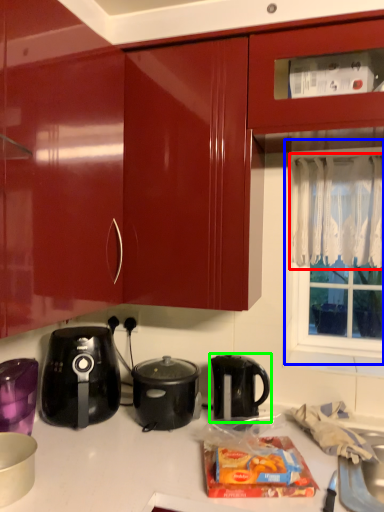
Question: Which object is positioned closest to curtain (highlighted by a red box)? Select from window screen (highlighted by a blue box) and kettle (highlighted by a green box).

Choices:
 (A) window screen
 (B) kettle

Answer: (A)